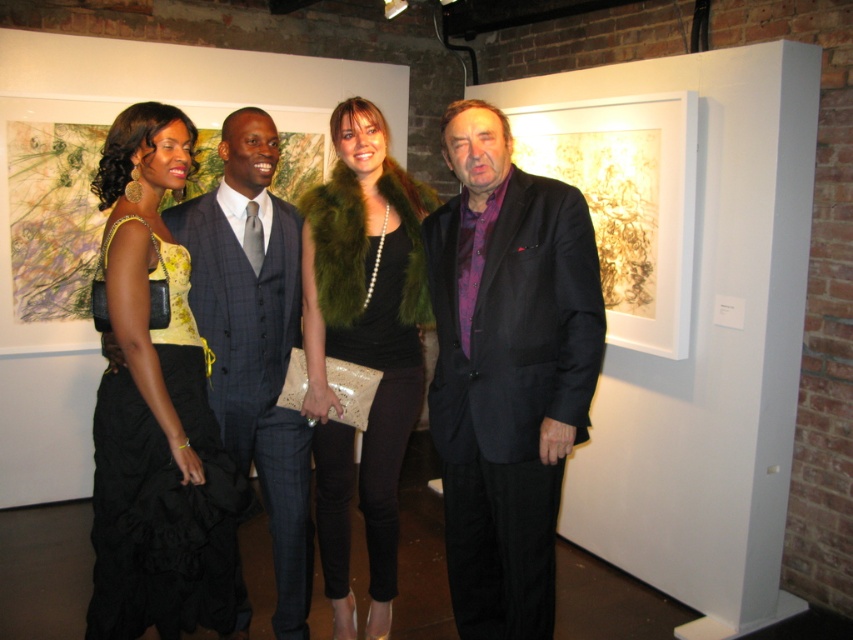
Question: Among these points, which one is farthest from the camera?

Choices:
 (A) (334, 600)
 (B) (193, 456)
 (C) (540, 428)
 (D) (293, 236)

Answer: (A)

Question: Which object appears farthest from the camera in this image?

Choices:
 (A) matte black suit at center
 (B) green fur vest at center

Answer: (B)

Question: Does matte black suit at center have a greater width compared to green fur vest at center?

Choices:
 (A) no
 (B) yes

Answer: (B)

Question: Among these objects, which one is nearest to the camera?

Choices:
 (A) matte black suit at center
 (B) green fur vest at center
 (C) plaid wool business suit at center

Answer: (A)

Question: Does matte black suit at center appear on the right side of plaid wool business suit at center?

Choices:
 (A) no
 (B) yes

Answer: (B)

Question: Does black satin dress at left appear on the right side of plaid wool business suit at center?

Choices:
 (A) yes
 (B) no

Answer: (B)